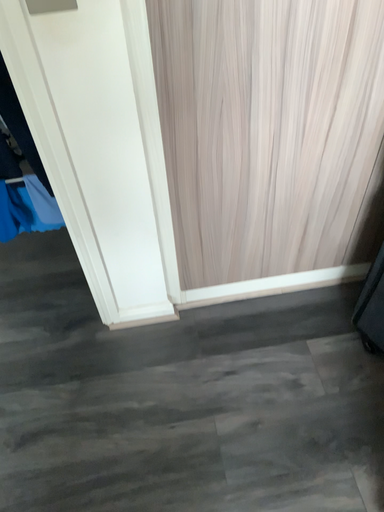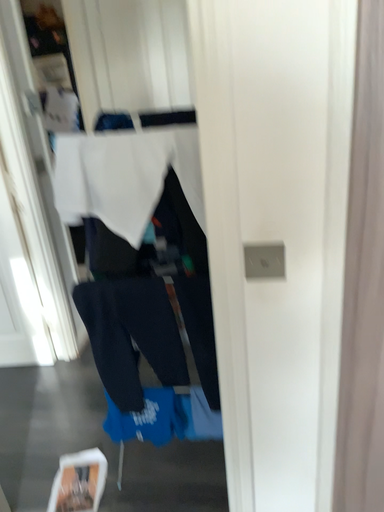
Question: Which way did the camera rotate in the video?

Choices:
 (A) rotated upward
 (B) rotated downward

Answer: (A)